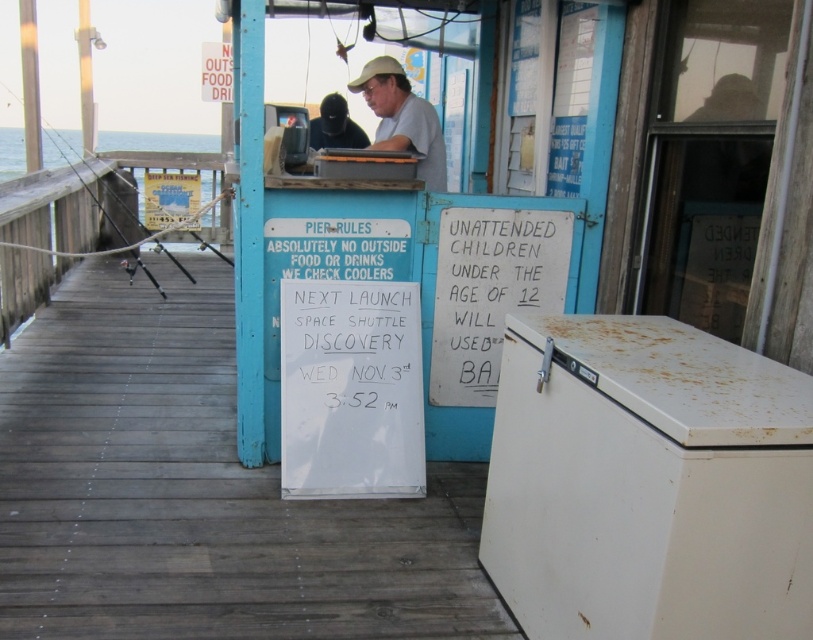
You are a visitor at the pier and you see the matte khaki hat at upper center and the black plastic fishing pole at left. Which object is positioned lower in the image?

The matte khaki hat at upper center is below the black plastic fishing pole at left, so the matte khaki hat at upper center is positioned lower in the image.

What is the relationship between the white wood dock at center and the white matte cooler at right in terms of their positioning?

The white wood dock at center is positioned to the left of the white matte cooler at right.